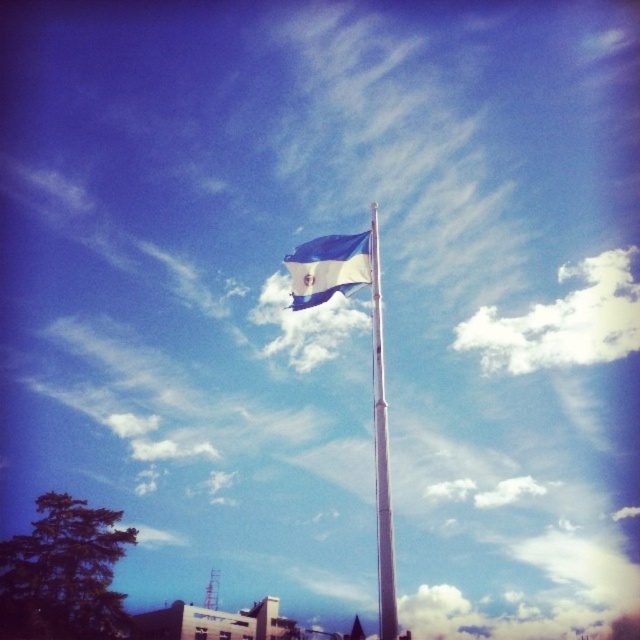
Question: Can you confirm if white metallic pole at center is positioned to the right of blue fabric flag at upper center?

Choices:
 (A) no
 (B) yes

Answer: (B)

Question: Does white metallic pole at center have a greater width compared to blue fabric flag at upper center?

Choices:
 (A) no
 (B) yes

Answer: (B)

Question: Is white metallic pole at center in front of blue fabric flag at upper center?

Choices:
 (A) no
 (B) yes

Answer: (B)

Question: Which of the following is the closest to the observer?

Choices:
 (A) 378,528
 (B) 314,296

Answer: (B)

Question: Which object is closer to the camera taking this photo?

Choices:
 (A) white metallic pole at center
 (B) blue fabric flag at upper center

Answer: (A)